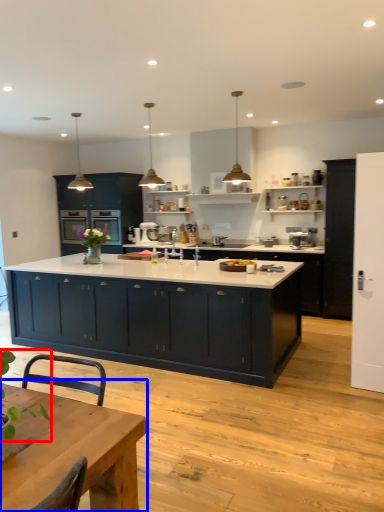
Question: Which object is closer to the camera taking this photo, plant (highlighted by a red box) or table (highlighted by a blue box)?

Choices:
 (A) plant
 (B) table

Answer: (A)